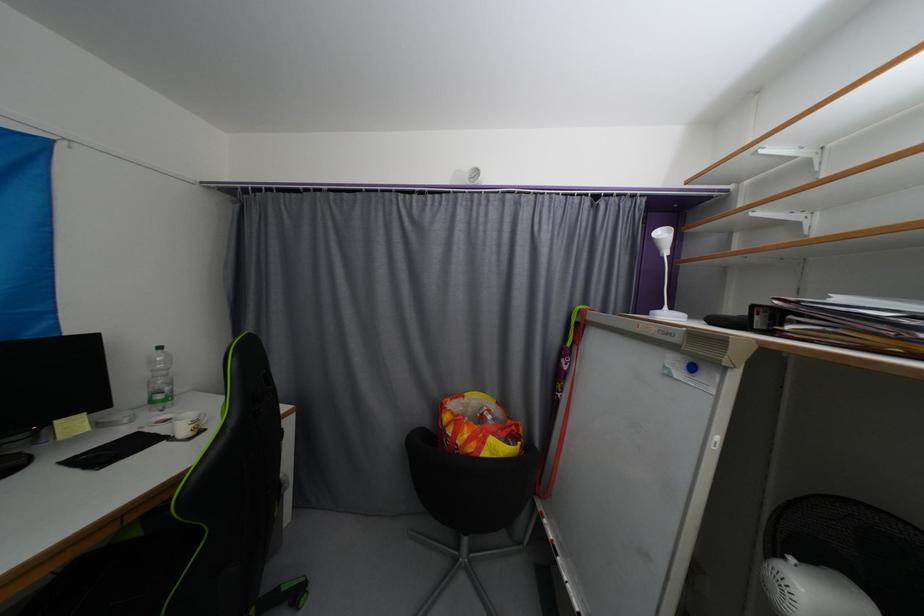
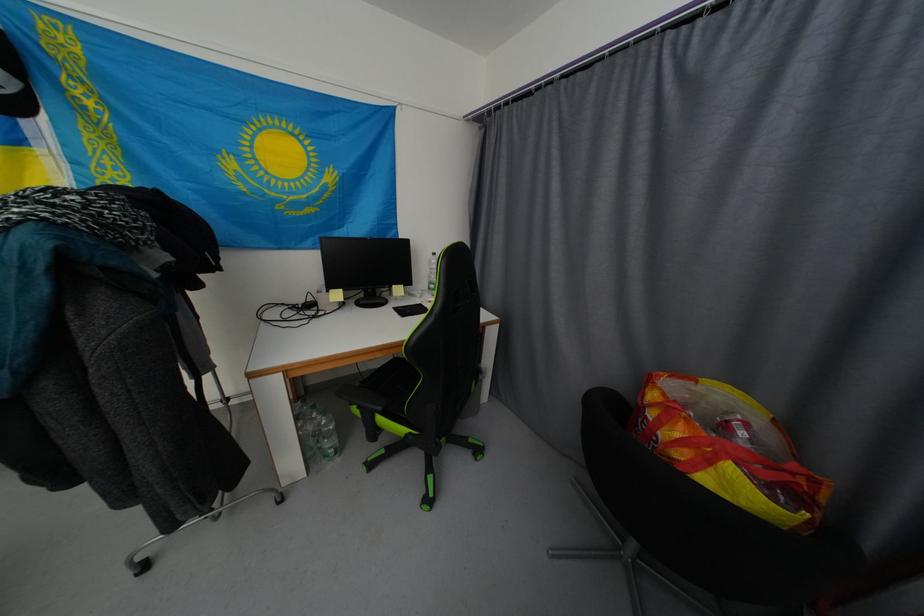
The images are taken continuously from a first-person perspective. In which direction is your viewpoint rotating?

The camera rotated toward left-down.